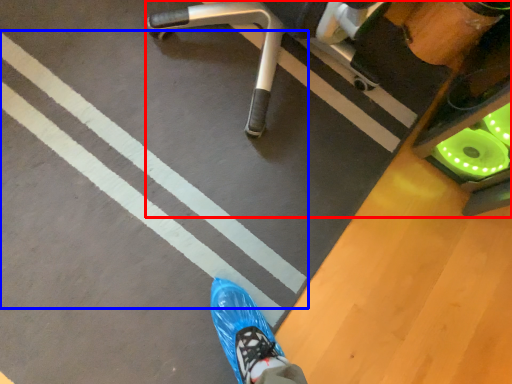
Question: Which of the following is the farthest to the observer, furniture (highlighted by a red box) or strip (highlighted by a blue box)?

Choices:
 (A) furniture
 (B) strip

Answer: (B)